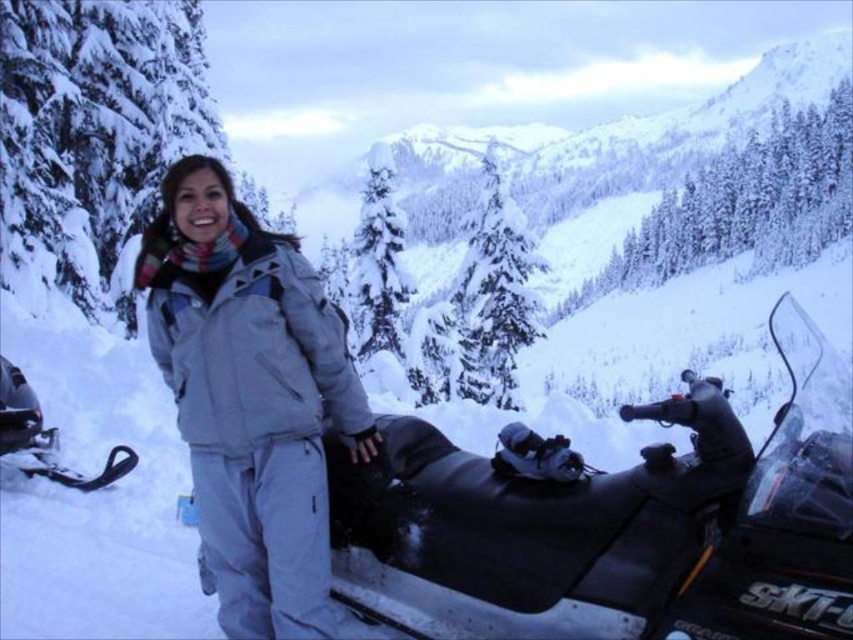
Which is more to the left, black rubber snowmobile at center or light gray snowsuit at center?

light gray snowsuit at center

Does black rubber snowmobile at center appear under light gray snowsuit at center?

Correct, black rubber snowmobile at center is located below light gray snowsuit at center.

Between point (625, 486) and point (316, 372), which one is positioned behind?

The point (316, 372) is behind.

Locate an element on the screen. This screenshot has width=853, height=640. black rubber snowmobile at center is located at coordinates (613, 522).